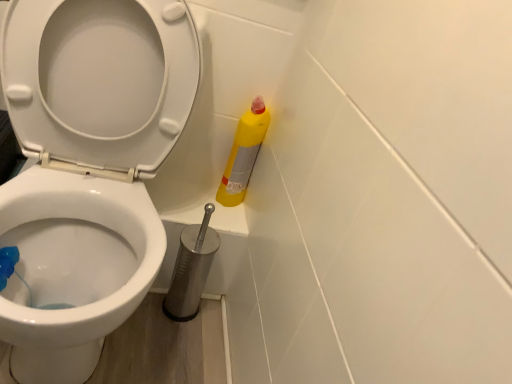
Question: Should I look upward or downward to see white glossy toilet at center?

Choices:
 (A) up
 (B) down

Answer: (A)

Question: Does yellow matte bottle at right come in front of metallic silver toilet brush at lower center?

Choices:
 (A) yes
 (B) no

Answer: (B)

Question: Is yellow matte bottle at right facing towards metallic silver toilet brush at lower center?

Choices:
 (A) no
 (B) yes

Answer: (A)

Question: From the image's perspective, would you say yellow matte bottle at right is positioned over metallic silver toilet brush at lower center?

Choices:
 (A) no
 (B) yes

Answer: (B)

Question: Considering the relative sizes of yellow matte bottle at right and metallic silver toilet brush at lower center in the image provided, is yellow matte bottle at right taller than metallic silver toilet brush at lower center?

Choices:
 (A) yes
 (B) no

Answer: (B)

Question: From the image's perspective, is yellow matte bottle at right beneath metallic silver toilet brush at lower center?

Choices:
 (A) yes
 (B) no

Answer: (B)

Question: Considering the relative sizes of yellow matte bottle at right and metallic silver toilet brush at lower center in the image provided, is yellow matte bottle at right thinner than metallic silver toilet brush at lower center?

Choices:
 (A) no
 (B) yes

Answer: (B)

Question: Is metallic silver toilet brush at lower center shorter than white glossy toilet at center?

Choices:
 (A) no
 (B) yes

Answer: (B)

Question: Can you confirm if metallic silver toilet brush at lower center is positioned to the left of white glossy toilet at center?

Choices:
 (A) no
 (B) yes

Answer: (A)

Question: Would you say metallic silver toilet brush at lower center is a long distance from white glossy toilet at center?

Choices:
 (A) yes
 (B) no

Answer: (B)

Question: Is metallic silver toilet brush at lower center positioned with its back to white glossy toilet at center?

Choices:
 (A) no
 (B) yes

Answer: (A)

Question: Considering the relative sizes of metallic silver toilet brush at lower center and white glossy toilet at center in the image provided, is metallic silver toilet brush at lower center smaller than white glossy toilet at center?

Choices:
 (A) no
 (B) yes

Answer: (B)

Question: From a real-world perspective, is metallic silver toilet brush at lower center physically above white glossy toilet at center?

Choices:
 (A) no
 (B) yes

Answer: (A)

Question: Can you confirm if metallic silver toilet brush at lower center is taller than yellow matte bottle at right?

Choices:
 (A) no
 (B) yes

Answer: (B)